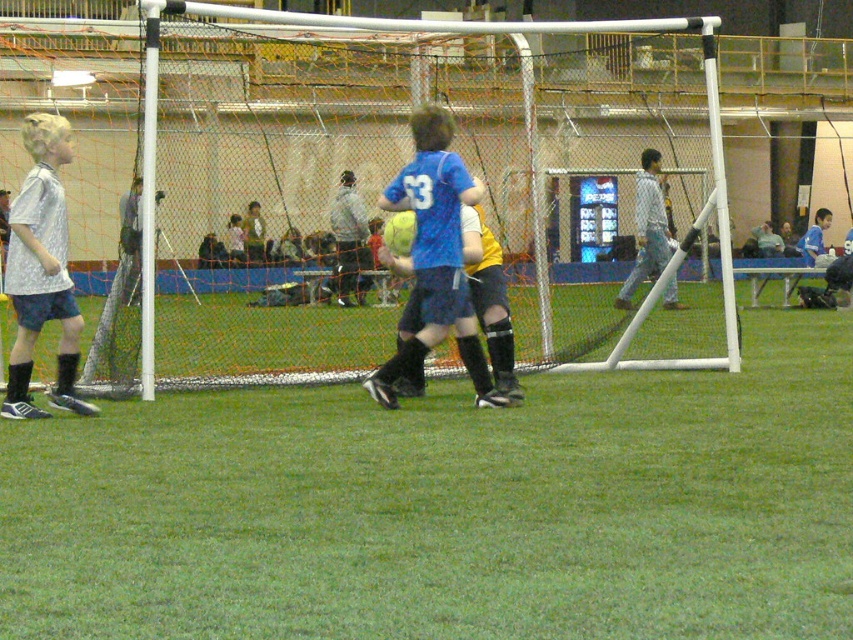
Question: Is green grass at center smaller than silver metallic shirt at left?

Choices:
 (A) no
 (B) yes

Answer: (B)

Question: Among these points, which one is farthest from the camera?

Choices:
 (A) (659, 436)
 (B) (16, 272)

Answer: (B)

Question: Which point is closer to the camera?

Choices:
 (A) (329, 211)
 (B) (74, 618)

Answer: (B)

Question: Can you confirm if light blue shirt at center is thinner than white shirt at center?

Choices:
 (A) no
 (B) yes

Answer: (A)

Question: Does silver metallic shirt at left have a lesser width compared to light blue shirt at center?

Choices:
 (A) no
 (B) yes

Answer: (B)

Question: Among these points, which one is nearest to the camera?

Choices:
 (A) (109, 282)
 (B) (448, 262)
 (C) (22, 541)

Answer: (C)